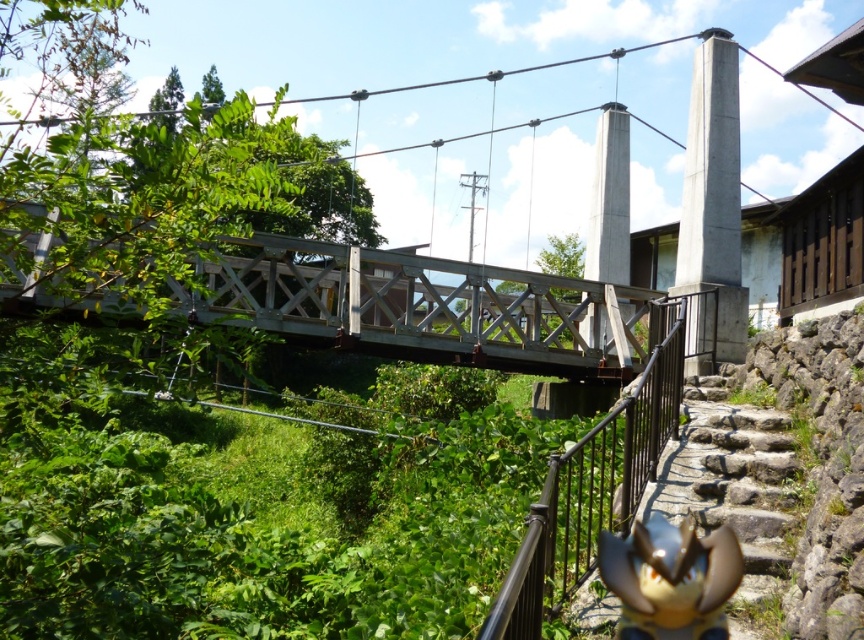
Is wooden bridge at center to the right of black metal railing at center from the viewer's perspective?

In fact, wooden bridge at center is to the left of black metal railing at center.

Is wooden bridge at center wider than black metal railing at center?

Indeed, wooden bridge at center has a greater width compared to black metal railing at center.

Which is behind, point (35, 300) or point (627, 497)?

The point (35, 300) is more distant.

Locate an element on the screen. Image resolution: width=864 pixels, height=640 pixels. wooden bridge at center is located at coordinates (423, 307).

Does wooden bridge at center have a larger size compared to stone/stone stairs at lower right?

Yes.

Is point (208, 289) less distant than point (725, 509)?

That is False.

The width and height of the screenshot is (864, 640). Find the location of `wooden bridge at center`. wooden bridge at center is located at coordinates (423, 307).

Find the location of `wooden bridge at center`. wooden bridge at center is located at coordinates (423, 307).

Which is more to the right, black metal railing at center or stone/stone stairs at lower right?

Positioned to the right is stone/stone stairs at lower right.

The image size is (864, 640). Find the location of `black metal railing at center`. black metal railing at center is located at coordinates (594, 484).